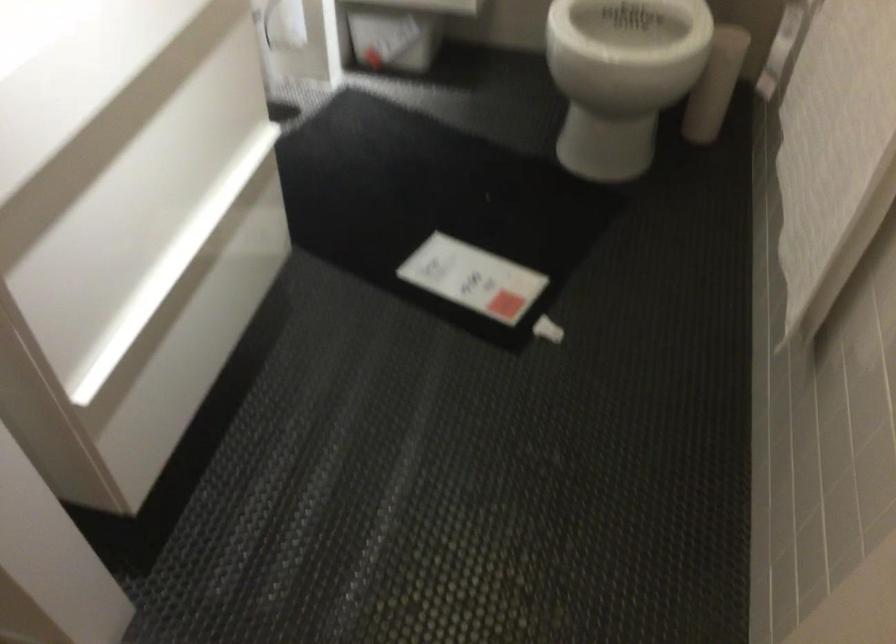
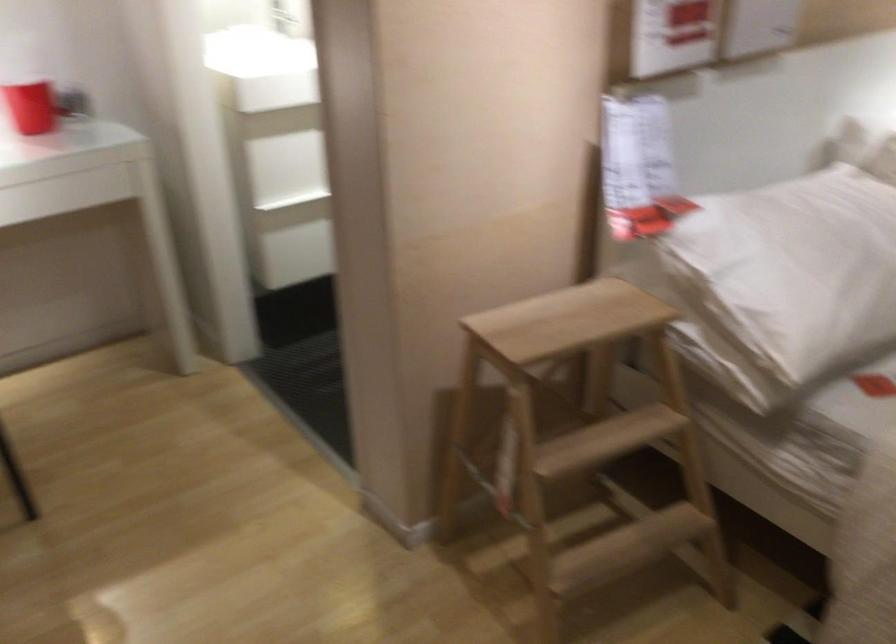
Question: I am providing you with two images of the same scene from different viewpoints. After the viewpoint changes to image2, which objects are now occluded?

Choices:
 (A) patterned plastic cup
 (B) red cup
 (C) white pillow
 (D) white drawer handle

Answer: (D)